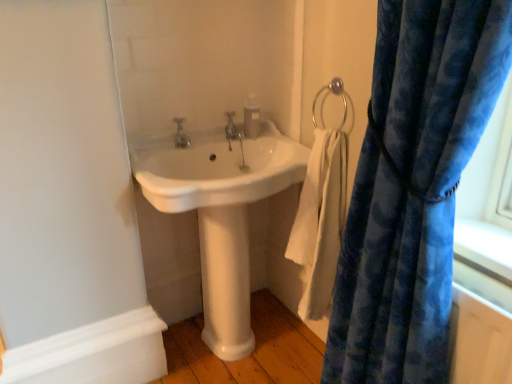
Question: Should I look upward or downward to see velvety blue curtain at right?

Choices:
 (A) up
 (B) down

Answer: (B)

Question: Is velvety blue curtain at right at the left side of white cotton towel at lower right?

Choices:
 (A) yes
 (B) no

Answer: (B)

Question: From a real-world perspective, is velvety blue curtain at right below white cotton towel at lower right?

Choices:
 (A) no
 (B) yes

Answer: (A)

Question: Can you confirm if velvety blue curtain at right is smaller than white cotton towel at lower right?

Choices:
 (A) no
 (B) yes

Answer: (A)

Question: Is velvety blue curtain at right further to camera compared to white cotton towel at lower right?

Choices:
 (A) no
 (B) yes

Answer: (A)

Question: From the image's perspective, is velvety blue curtain at right over white cotton towel at lower right?

Choices:
 (A) no
 (B) yes

Answer: (A)

Question: From the image's perspective, is velvety blue curtain at right under white cotton towel at lower right?

Choices:
 (A) no
 (B) yes

Answer: (B)

Question: Considering the relative sizes of polished chrome faucet at center, positioned as the 2th tap in left-to-right order, and white glossy sink at center in the image provided, is polished chrome faucet at center, positioned as the 2th tap in left-to-right order, taller than white glossy sink at center?

Choices:
 (A) yes
 (B) no

Answer: (B)

Question: Is the position of polished chrome faucet at center, arranged as the 2th tap when viewed from the front, more distant than that of white glossy sink at center?

Choices:
 (A) yes
 (B) no

Answer: (A)

Question: Is polished chrome faucet at center, acting as the first tap starting from the back, oriented towards white glossy sink at center?

Choices:
 (A) yes
 (B) no

Answer: (B)

Question: Is polished chrome faucet at center, acting as the first tap starting from the back, not close to white glossy sink at center?

Choices:
 (A) yes
 (B) no

Answer: (B)

Question: Does polished chrome faucet at center, the first tap from the right, lie in front of white glossy sink at center?

Choices:
 (A) yes
 (B) no

Answer: (B)

Question: Is polished chrome faucet at center, positioned as the 2th tap in left-to-right order, located outside white glossy sink at center?

Choices:
 (A) no
 (B) yes

Answer: (A)

Question: From the image's perspective, is white cotton towel at lower right on top of velvety blue curtain at right?

Choices:
 (A) yes
 (B) no

Answer: (A)